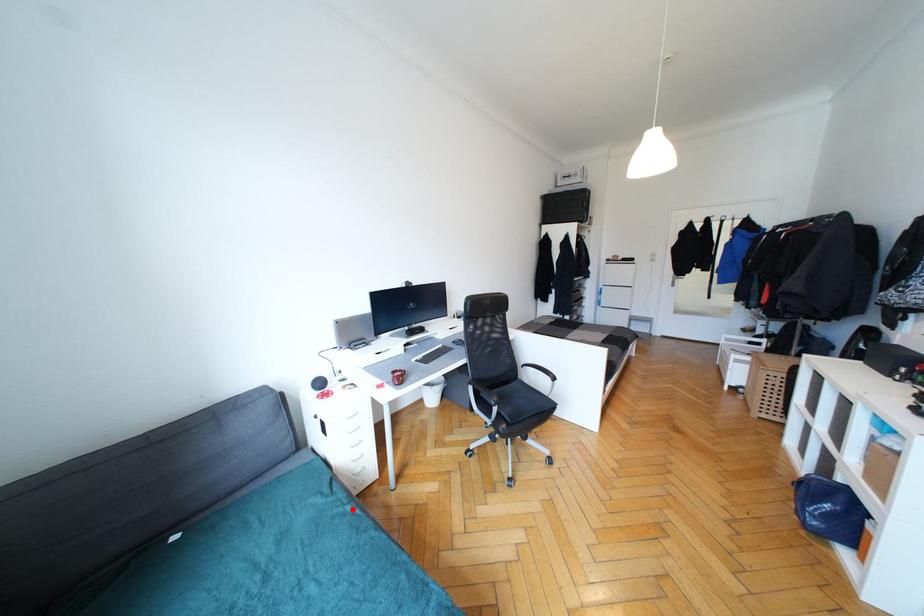
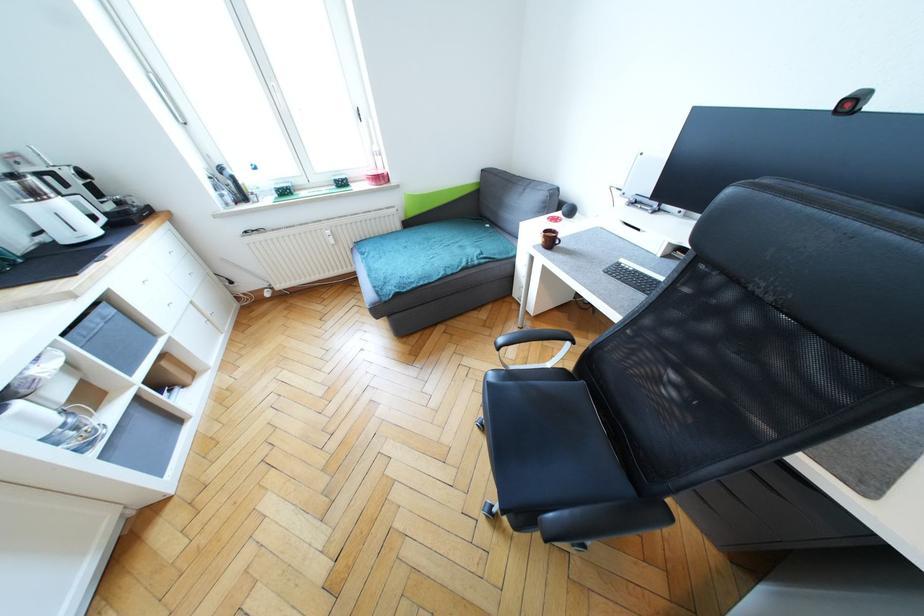
Locate, in the second image, the point that corresponds to the highlighted location in the first image.

(467, 265)